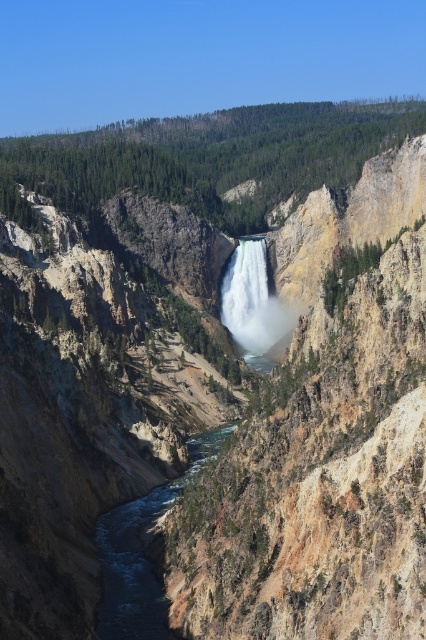
You are a hiker standing at the edge of the canyon and see the clear water at center and the white smooth waterfall at center. Which one is closer to you?

The white smooth waterfall at center is closer to you because the clear water at center is located below it.

You are standing at the edge of the canyon and see the clear water at center and the white smooth waterfall at center. Which one is closer to your left side?

The clear water at center is closer to your left side because it is located to the left of the white smooth waterfall at center.